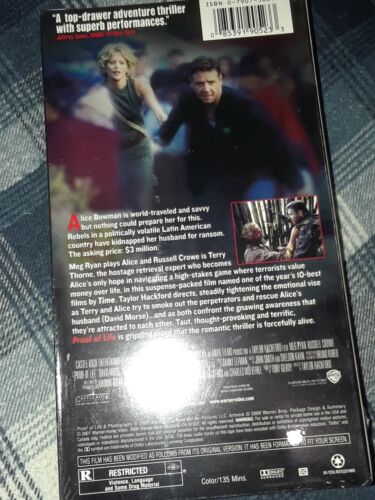
Locate an element on the screen. The image size is (375, 500). dvd is located at coordinates (324, 332).